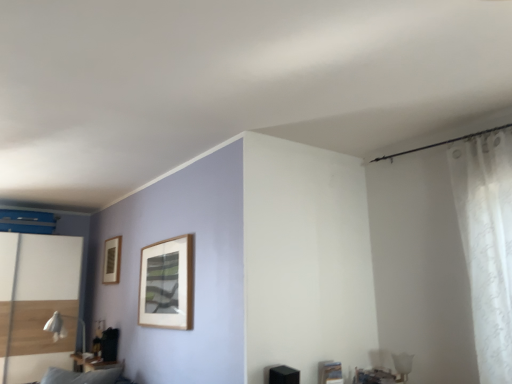
Question: Is white glossy screen door at left taller or shorter than wooden picture frame at upper left?

Choices:
 (A) short
 (B) tall

Answer: (B)

Question: From a real-world perspective, is white glossy screen door at left positioned above or below wooden picture frame at upper left?

Choices:
 (A) above
 (B) below

Answer: (B)

Question: Which object is positioned closest to the matte black table at lower left?

Choices:
 (A) wooden picture frame at upper left
 (B) white sheer curtain at right
 (C) white glossy screen door at left
 (D) white fabric table lamp at lower left

Answer: (D)

Question: Which is nearer to the matte black table at lower left?

Choices:
 (A) wooden picture frame at upper left
 (B) white sheer curtain at right
 (C) white glossy screen door at left
 (D) white fabric table lamp at lower left

Answer: (D)